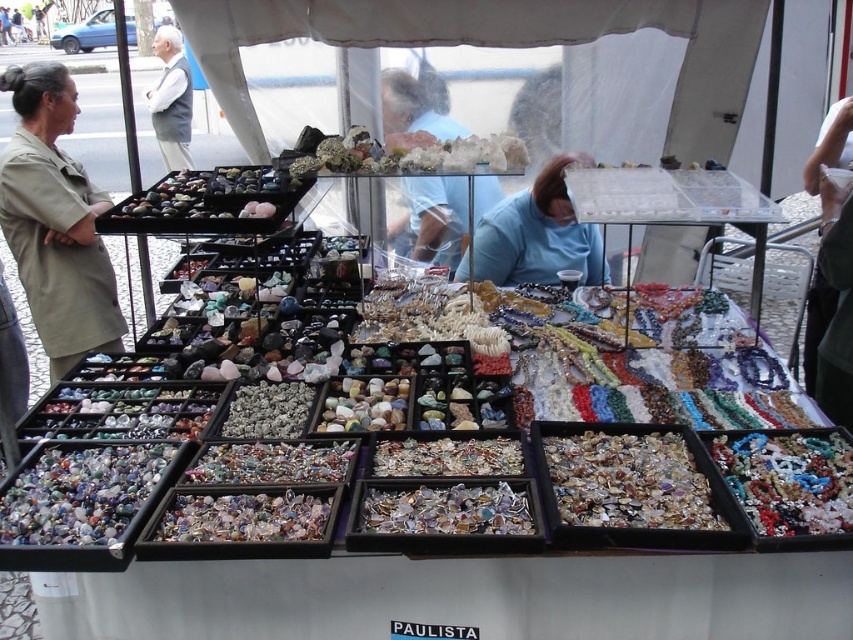
Does point (10, 188) come behind point (160, 129)?

No.

The height and width of the screenshot is (640, 853). I want to click on beige uniform at left, so (55, 221).

Does point (39, 298) lie in front of point (167, 54)?

Yes.

Identify the location of beige uniform at left. Image resolution: width=853 pixels, height=640 pixels. (55, 221).

Who is positioned more to the right, blue fabric at center or white vest at upper left?

Positioned to the right is blue fabric at center.

Looking at this image, between blue fabric at center and white vest at upper left, which one appears on the left side from the viewer's perspective?

white vest at upper left is more to the left.

Where is `blue fabric at center`? blue fabric at center is located at coordinates (538, 234).

Between beige uniform at left and blue fabric at center, which one has more height?

beige uniform at left

Is beige uniform at left in front of blue fabric at center?

Yes, it is.

The width and height of the screenshot is (853, 640). In order to click on beige uniform at left in this screenshot , I will do `click(55, 221)`.

At what (x,y) coordinates should I click in order to perform the action: click on beige uniform at left. Please return your answer as a coordinate pair (x, y). This screenshot has width=853, height=640. Looking at the image, I should click on pyautogui.click(x=55, y=221).